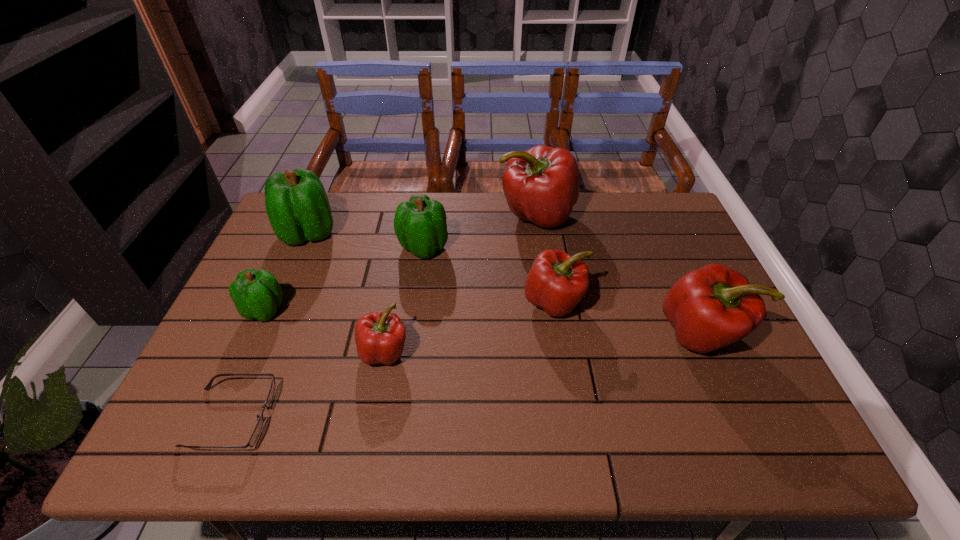
Where is `object present at the right edge`? The width and height of the screenshot is (960, 540). object present at the right edge is located at coordinates (714, 306).

At what (x,y) coordinates should I click in order to perform the action: click on object located at the far left corner. Please return your answer as a coordinate pair (x, y). Image resolution: width=960 pixels, height=540 pixels. Looking at the image, I should click on (297, 205).

The width and height of the screenshot is (960, 540). Identify the location of object that is at the near left corner. (253, 438).

The width and height of the screenshot is (960, 540). In the image, there is a desktop. Identify the location of vacant space at the near edge. (533, 420).

Locate an element on the screen. The height and width of the screenshot is (540, 960). free space at the left edge of the desktop is located at coordinates (201, 377).

Locate an element on the screen. vacant space at the right edge of the desktop is located at coordinates (664, 255).

Identify the location of vacant region at the far right corner of the desktop. (661, 227).

At what (x,y) coordinates should I click in order to perform the action: click on unoccupied area between the spectacles and the smallest pink bell pepper. Please return your answer as a coordinate pair (x, y). This screenshot has width=960, height=540. Looking at the image, I should click on point(307,384).

Locate an element on the screen. vacant space that's between the smallest green bell pepper and the rightmost green bell pepper is located at coordinates (345, 279).

Locate an element on the screen. The width and height of the screenshot is (960, 540). free space between the third biggest pink bell pepper and the third smallest pink bell pepper is located at coordinates (627, 318).